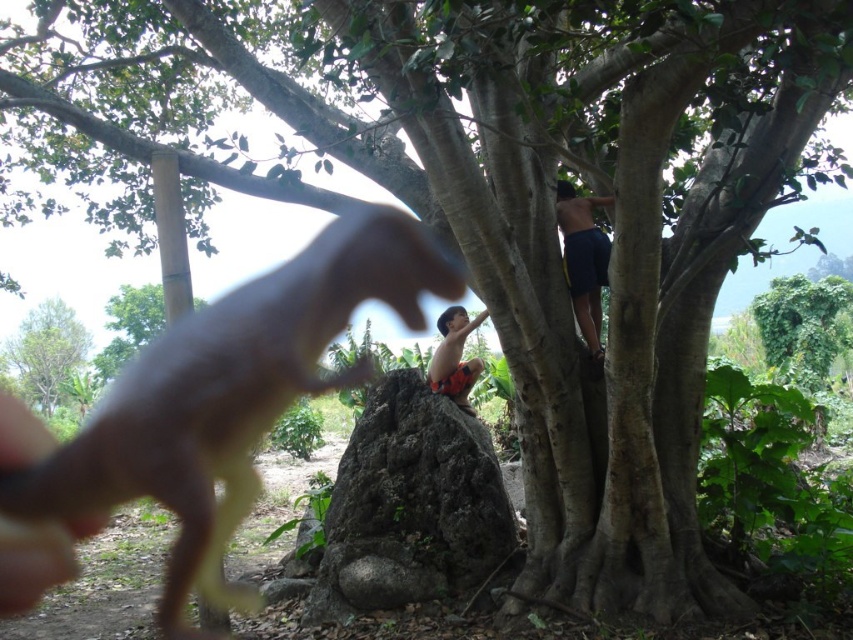
The width and height of the screenshot is (853, 640). Find the location of `brown matte dinosaur at left`. brown matte dinosaur at left is located at coordinates [x=229, y=387].

Who is positioned more to the right, green leafy tree at upper left or orange patterned shorts at center?

orange patterned shorts at center is more to the right.

Does green leafy tree at upper left have a lesser width compared to orange patterned shorts at center?

Incorrect, green leafy tree at upper left's width is not less than orange patterned shorts at center's.

What do you see at coordinates (47, 353) in the screenshot? I see `green leafy tree at upper left` at bounding box center [47, 353].

Image resolution: width=853 pixels, height=640 pixels. I want to click on green leafy tree at upper left, so click(x=47, y=353).

Which of these two, gray rough rock at center or dark blue shorts at upper right, stands taller?

Standing taller between the two is gray rough rock at center.

The image size is (853, 640). Describe the element at coordinates (410, 504) in the screenshot. I see `gray rough rock at center` at that location.

The height and width of the screenshot is (640, 853). What do you see at coordinates (410, 504) in the screenshot?
I see `gray rough rock at center` at bounding box center [410, 504].

Locate an element on the screen. gray rough rock at center is located at coordinates (410, 504).